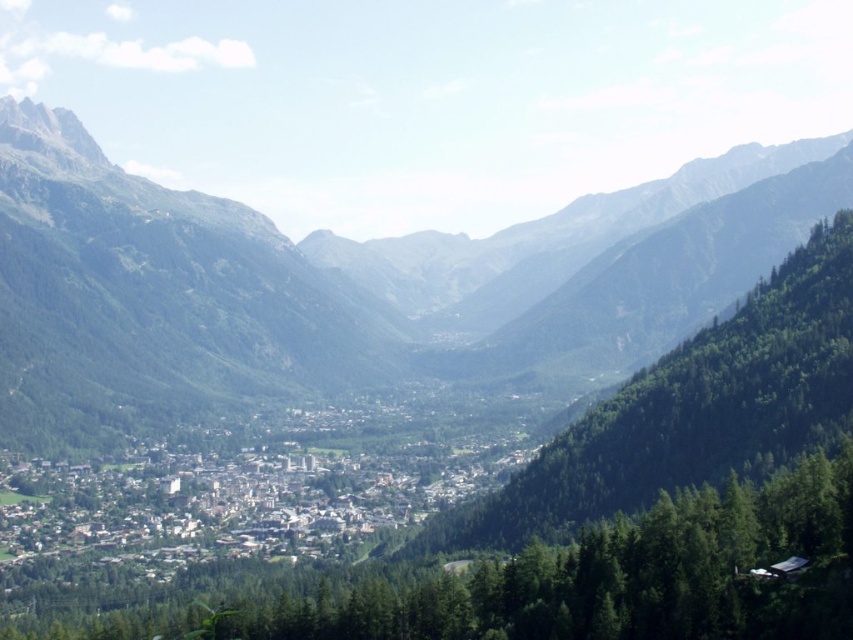
You are a hiker planning to cross the valley and have to decide between two paths. One path goes through the green forested mountain at center and the other through the green leafy trees at center. Considering the width of the paths, which path would allow you to walk side by side with a friend more comfortably?

The path through the green forested mountain at center would allow you to walk side by side with a friend more comfortably since its width surpasses that of the green leafy trees at center.

You are an environmental scientist studying the valley. You observe two types of trees at the center of the valley. Which one is located to the left of the other? The trees are labeled as green textured trees at center and green leafy trees at center.

The green textured trees at center is positioned on the left side of green leafy trees at center.

You are standing in the valley and want to determine the relative positions of two points marked in the scene. Which point, point (165, 620) or point (428, 536), is closer to you?

Point (165, 620) is closer to the viewer than point (428, 536).